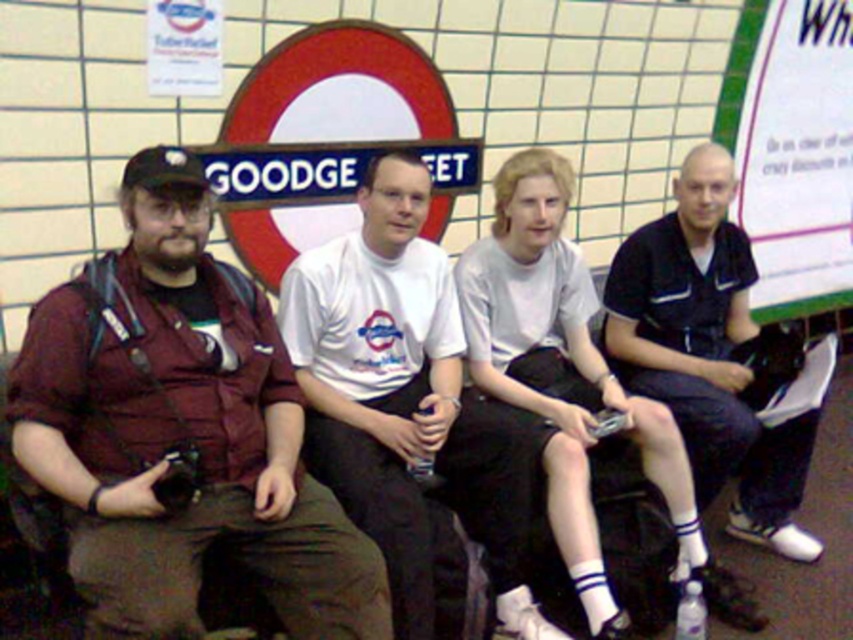
Question: Does maroon fabric shirt at left have a lesser width compared to dark blue polo shirt at center?

Choices:
 (A) yes
 (B) no

Answer: (B)

Question: Based on their relative distances, which object is farther from the white cotton t-shirt at center?

Choices:
 (A) dark blue polo shirt at center
 (B) maroon fabric shirt at left

Answer: (A)

Question: Which point appears closest to the camera in this image?

Choices:
 (A) (703, 483)
 (B) (143, 550)
 (C) (387, 516)

Answer: (B)

Question: Which is nearer to the dark blue polo shirt at center?

Choices:
 (A) white cotton t-shirt at center
 (B) maroon fabric shirt at left

Answer: (A)

Question: Can you confirm if white cotton t-shirt at center is positioned below dark blue polo shirt at center?

Choices:
 (A) no
 (B) yes

Answer: (B)

Question: Is maroon fabric shirt at left thinner than dark blue polo shirt at center?

Choices:
 (A) yes
 (B) no

Answer: (B)